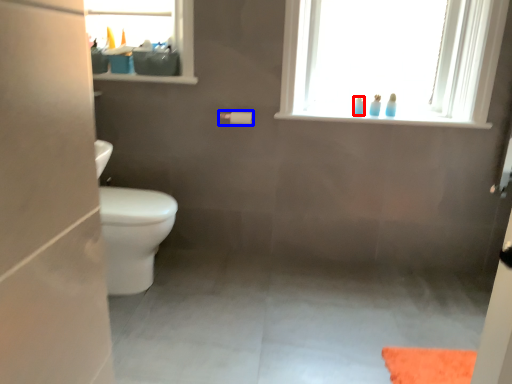
Question: Which of the following is the closest to the observer, toiletry (highlighted by a red box) or toilet paper (highlighted by a blue box)?

Choices:
 (A) toiletry
 (B) toilet paper

Answer: (B)